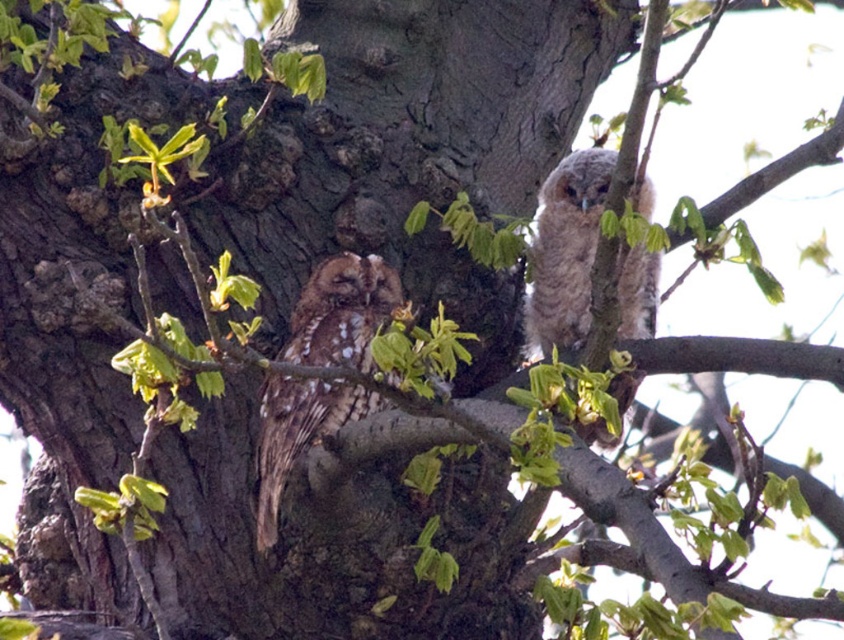
You are an ornithologist observing two owls in a tree. You notice the brown speckled owl at left and the speckled brown owl at upper right. Which owl is closer to you, the observer?

The brown speckled owl at left is closer to you because the speckled brown owl at upper right is behind it.

You are standing in front of the tree with two owls. You see a point marked at coordinates (341, 312). Which owl is this point located on?

The point at coordinates (341, 312) is located on the brown speckled owl at left.